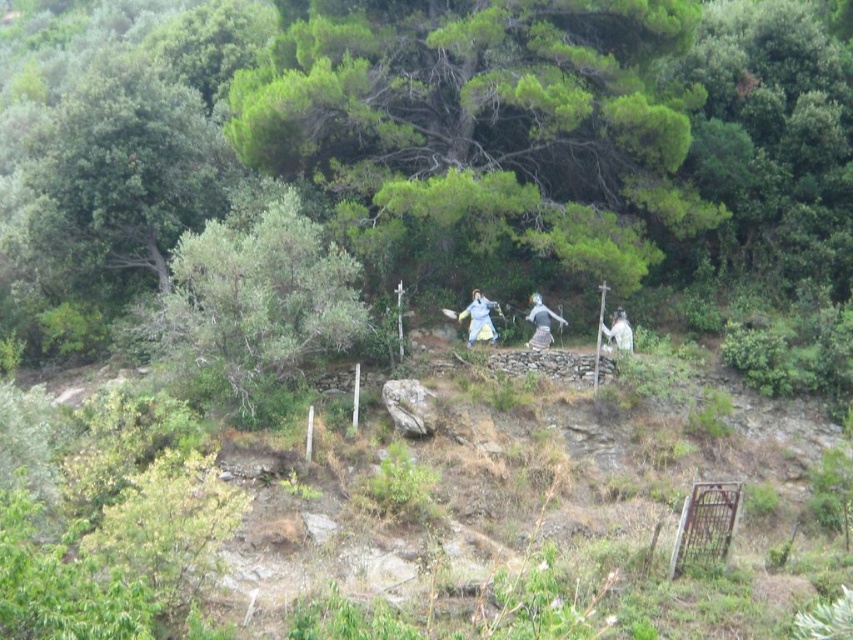
Does metallic silver statue at center lie behind white matte statue at center?

Yes, metallic silver statue at center is further from the viewer.

What do you see at coordinates (541, 323) in the screenshot? I see `metallic silver statue at center` at bounding box center [541, 323].

Image resolution: width=853 pixels, height=640 pixels. Describe the element at coordinates (541, 323) in the screenshot. I see `metallic silver statue at center` at that location.

Locate an element on the screen. The image size is (853, 640). metallic silver statue at center is located at coordinates (541, 323).

Is green leafy tree at center bigger than metallic silver statue at center?

Correct, green leafy tree at center is larger in size than metallic silver statue at center.

Measure the distance between green leafy tree at center and camera.

green leafy tree at center and camera are 57.67 feet apart from each other.

Image resolution: width=853 pixels, height=640 pixels. What are the coordinates of `green leafy tree at center` in the screenshot? It's located at (253, 305).

Describe the element at coordinates (479, 317) in the screenshot. This screenshot has height=640, width=853. I see `matte white statue at center` at that location.

Which is more to the left, matte white statue at center or white matte statue at center?

From the viewer's perspective, matte white statue at center appears more on the left side.

Which is behind, point (482, 312) or point (610, 349)?

The point (482, 312) is more distant.

You are a GUI agent. You are given a task and a screenshot of the screen. Output one action in this format:
    pyautogui.click(x=<x>, y=<y>)
    Task: Click on the matte white statue at center
    This screenshot has height=640, width=853.
    Given the screenshot: What is the action you would take?
    pyautogui.click(x=479, y=317)